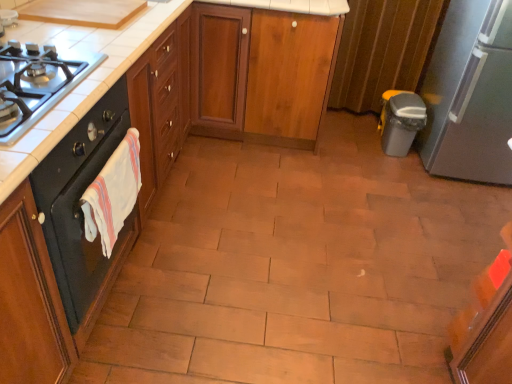
What do you see at coordinates (470, 94) in the screenshot?
I see `satin silver refrigerator at right` at bounding box center [470, 94].

Identify the location of satin silver refrigerator at right. coord(470,94).

Image resolution: width=512 pixels, height=384 pixels. What do you see at coordinates (79, 200) in the screenshot?
I see `black matte oven at left` at bounding box center [79, 200].

The width and height of the screenshot is (512, 384). Describe the element at coordinates (37, 83) in the screenshot. I see `black matte gas stove at left` at that location.

Where is `wooden cabinet at center, which is counted as the second cabinetry, starting from the front`? This screenshot has width=512, height=384. wooden cabinet at center, which is counted as the second cabinetry, starting from the front is located at coordinates (282, 72).

I want to click on satin silver refrigerator at right, so click(470, 94).

Which of these two, wooden cabinet at center, which is the 2th cabinetry in back-to-front order, or black matte oven at left, stands shorter?

black matte oven at left is shorter.

From the image's perspective, which object appears higher, wooden cabinet at center, placed as the first cabinetry when sorted from front to back, or black matte oven at left?

From the image's view, wooden cabinet at center, placed as the first cabinetry when sorted from front to back, is above.

Which is more to the left, wooden cabinet at center, placed as the first cabinetry when sorted from front to back, or black matte oven at left?

From the viewer's perspective, black matte oven at left appears more on the left side.

Identify the location of home appliance below the wooden cabinet at center, placed as the first cabinetry when sorted from front to back (from the image's perspective). The image size is (512, 384). (79, 200).

Relative to white cotton hand towel at left, is wooden cabinet at center, placed as the first cabinetry when sorted from front to back, in front or behind?

In the image, wooden cabinet at center, placed as the first cabinetry when sorted from front to back, appears in front of white cotton hand towel at left.

Which point is more distant from viewer, (x=102, y=293) or (x=131, y=183)?

Positioned behind is point (x=102, y=293).

From the image's perspective, is wooden cabinet at center, which is the 2th cabinetry in back-to-front order, above white cotton hand towel at left?

Indeed, from the image's perspective, wooden cabinet at center, which is the 2th cabinetry in back-to-front order, is shown above white cotton hand towel at left.

Considering the sizes of white cotton hand towel at left and black matte oven at left in the image, is white cotton hand towel at left wider or thinner than black matte oven at left?

white cotton hand towel at left is thinner than black matte oven at left.

From the picture: Considering their positions, is white cotton hand towel at left located in front of or behind black matte oven at left?

white cotton hand towel at left is positioned farther from the viewer than black matte oven at left.

From the image's perspective, is white cotton hand towel at left positioned above or below black matte oven at left?

Clearly, from the image's perspective, white cotton hand towel at left is above black matte oven at left.

Is white cotton hand towel at left not within black matte oven at left?

white cotton hand towel at left is positioned outside black matte oven at left.

Is black matte oven at left turned away from satin silver refrigerator at right?

No.

Does point (59, 177) appear closer or farther from the camera than point (424, 135)?

Clearly, point (59, 177) is closer to the camera than point (424, 135).

Considering the sizes of objects black matte oven at left and satin silver refrigerator at right in the image provided, who is taller, black matte oven at left or satin silver refrigerator at right?

Standing taller between the two is satin silver refrigerator at right.

Locate an element on the screen. This screenshot has height=384, width=512. kitchen appliance that is above the black matte oven at left (from a real-world perspective) is located at coordinates (470, 94).

Does black matte oven at left have a lesser height compared to wooden cabinet at center, which is counted as the second cabinetry, starting from the front?

Correct, black matte oven at left is not as tall as wooden cabinet at center, which is counted as the second cabinetry, starting from the front.

Which point is more forward, (56, 236) or (281, 103)?

The point (56, 236) is more forward.

Considering the sizes of objects black matte oven at left and wooden cabinet at center, the 1th cabinetry when ordered from back to front, in the image provided, who is thinner, black matte oven at left or wooden cabinet at center, the 1th cabinetry when ordered from back to front,?

black matte oven at left is thinner.

Is the surface of black matte gas stove at left in direct contact with black matte oven at left?

No, black matte gas stove at left is not in contact with black matte oven at left.

In the image, is black matte gas stove at left positioned in front of or behind black matte oven at left?

black matte gas stove at left is positioned closer to the viewer than black matte oven at left.

Who is taller, black matte gas stove at left or black matte oven at left?

black matte oven at left.

Between black matte gas stove at left and wooden cabinet at center, the 1th cabinetry when ordered from back to front, which one has more height?

wooden cabinet at center, the 1th cabinetry when ordered from back to front, is taller.

Which is less distant, [15,79] or [250,87]?

Positioned in front is point [15,79].

Considering their positions, is black matte gas stove at left located in front of or behind wooden cabinet at center, the 1th cabinetry when ordered from back to front?

black matte gas stove at left is positioned closer to the viewer than wooden cabinet at center, the 1th cabinetry when ordered from back to front.

Locate an element on the screen. the 1st cabinetry above the black matte oven at left (from the image's perspective) is located at coordinates (160, 149).

The image size is (512, 384). In order to click on hand towel on the left of wooden cabinet at center, placed as the first cabinetry when sorted from front to back in this screenshot , I will do `click(113, 193)`.

From the image, which object appears to be nearer to satin silver refrigerator at right, black matte oven at left or white cotton hand towel at left?

Among the two, white cotton hand towel at left is located nearer to satin silver refrigerator at right.

Considering their positions, is wooden cabinet at center, which is the 2th cabinetry in back-to-front order, positioned further to wooden cabinet at center, which is counted as the second cabinetry, starting from the front, than black matte oven at left?

black matte oven at left.

Which object lies nearer to the anchor point wooden cabinet at center, which is counted as the second cabinetry, starting from the front, wooden cabinet at center, placed as the first cabinetry when sorted from front to back, or black matte gas stove at left?

wooden cabinet at center, placed as the first cabinetry when sorted from front to back, is closer to wooden cabinet at center, which is counted as the second cabinetry, starting from the front.

Estimate the real-world distances between objects in this image. Which object is further from wooden cabinet at center, placed as the first cabinetry when sorted from front to back, satin silver refrigerator at right or black matte gas stove at left?

Among the two, satin silver refrigerator at right is located further to wooden cabinet at center, placed as the first cabinetry when sorted from front to back.

From the image, which object appears to be farther from wooden cabinet at center, which is the 2th cabinetry in back-to-front order, white cotton hand towel at left or black matte oven at left?

white cotton hand towel at left.

Considering their positions, is satin silver refrigerator at right positioned further to wooden cabinet at center, which is the 2th cabinetry in back-to-front order, than wooden cabinet at center, which is counted as the second cabinetry, starting from the front?

The object further to wooden cabinet at center, which is the 2th cabinetry in back-to-front order, is satin silver refrigerator at right.

In the scene shown: From the image, which object appears to be nearer to black matte gas stove at left, wooden cabinet at center, placed as the first cabinetry when sorted from front to back, or satin silver refrigerator at right?

wooden cabinet at center, placed as the first cabinetry when sorted from front to back, lies closer to black matte gas stove at left than the other object.

Based on their spatial positions, is wooden cabinet at center, the 1th cabinetry when ordered from back to front, or wooden cabinet at center, placed as the first cabinetry when sorted from front to back, closer to white cotton hand towel at left?

wooden cabinet at center, placed as the first cabinetry when sorted from front to back, lies closer to white cotton hand towel at left than the other object.

Find the location of `home appliance positioned between wooden cabinet at center, placed as the first cabinetry when sorted from front to back, and wooden cabinet at center, which is counted as the second cabinetry, starting from the front, from near to far`. home appliance positioned between wooden cabinet at center, placed as the first cabinetry when sorted from front to back, and wooden cabinet at center, which is counted as the second cabinetry, starting from the front, from near to far is located at coordinates (79, 200).

This screenshot has height=384, width=512. In order to click on home appliance located between wooden cabinet at center, placed as the first cabinetry when sorted from front to back, and white cotton hand towel at left in the depth direction in this screenshot , I will do `click(79, 200)`.

What are the coordinates of `gas stove between wooden cabinet at center, which is the 2th cabinetry in back-to-front order, and black matte oven at left in the front-back direction` in the screenshot? It's located at (37, 83).

I want to click on hand towel between black matte gas stove at left and black matte oven at left vertically, so click(113, 193).